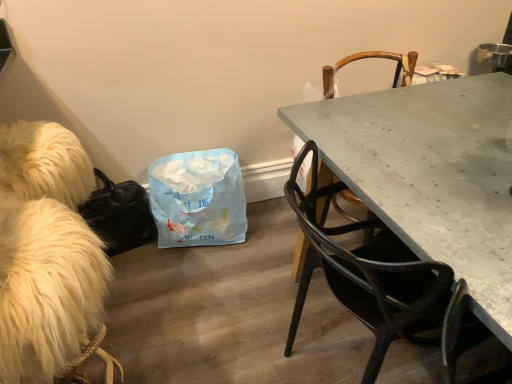
Locate an element on the screen. The image size is (512, 384). metallic gray chair at right, which appears as the 1th chair when viewed from the back is located at coordinates (373, 57).

Find the location of `light blue paper bag at center`. light blue paper bag at center is located at coordinates (198, 199).

This screenshot has width=512, height=384. Find the location of `white fluffy dog at left`. white fluffy dog at left is located at coordinates (46, 252).

Is metallic gray chair at right, the second chair when ordered from front to back, taller than light blue paper bag at center?

Indeed, metallic gray chair at right, the second chair when ordered from front to back, has a greater height compared to light blue paper bag at center.

From the image's perspective, which object appears higher, metallic gray chair at right, the second chair when ordered from front to back, or light blue paper bag at center?

metallic gray chair at right, the second chair when ordered from front to back, from the image's perspective.

In the image, is metallic gray chair at right, which appears as the 1th chair when viewed from the back, on the left side or the right side of matte black chair at right, the 1th chair viewed from the front?

metallic gray chair at right, which appears as the 1th chair when viewed from the back, is positioned on matte black chair at right, the 1th chair viewed from the front,'s right side.

Does metallic gray chair at right, the second chair when ordered from front to back, have a lesser width compared to matte black chair at right, which is counted as the 2th chair, starting from the back?

Indeed, metallic gray chair at right, the second chair when ordered from front to back, has a lesser width compared to matte black chair at right, which is counted as the 2th chair, starting from the back.

Is metallic gray chair at right, the second chair when ordered from front to back, not near matte black chair at right, which is counted as the 2th chair, starting from the back?

That's not correct — metallic gray chair at right, the second chair when ordered from front to back, is a little close to matte black chair at right, which is counted as the 2th chair, starting from the back.

Based on the photo, considering the relative sizes of metallic gray chair at right, which appears as the 1th chair when viewed from the back, and matte black chair at right, the 1th chair viewed from the front, in the image provided, is metallic gray chair at right, which appears as the 1th chair when viewed from the back, taller than matte black chair at right, the 1th chair viewed from the front,?

Correct, metallic gray chair at right, which appears as the 1th chair when viewed from the back, is much taller as matte black chair at right, the 1th chair viewed from the front.

From the image's perspective, which is above, matte black chair at right, which is counted as the 2th chair, starting from the back, or light blue paper bag at center?

light blue paper bag at center.

Can you confirm if matte black chair at right, the 1th chair viewed from the front, is thinner than light blue paper bag at center?

Incorrect, the width of matte black chair at right, the 1th chair viewed from the front, is not less than that of light blue paper bag at center.

Can light blue paper bag at center be found inside matte black chair at right, the 1th chair viewed from the front?

No, light blue paper bag at center is not inside matte black chair at right, the 1th chair viewed from the front.

Considering the points (313, 208) and (149, 180), which point is in front, point (313, 208) or point (149, 180)?

Positioned in front is point (313, 208).

Is white fluffy dog at left at the right side of metallic gray chair at right, the second chair when ordered from front to back?

In fact, white fluffy dog at left is to the left of metallic gray chair at right, the second chair when ordered from front to back.

From the image's perspective, between white fluffy dog at left and metallic gray chair at right, the second chair when ordered from front to back, who is located below?

white fluffy dog at left, from the image's perspective.

This screenshot has width=512, height=384. I want to click on the 2nd chair positioned above the white fluffy dog at left (from a real-world perspective), so click(373, 57).

Is white fluffy dog at left not close to metallic gray chair at right, which appears as the 1th chair when viewed from the back?

That's right, there is a large distance between white fluffy dog at left and metallic gray chair at right, which appears as the 1th chair when viewed from the back.

At what (x,y) coordinates should I click in order to perform the action: click on chair below the metallic gray chair at right, the second chair when ordered from front to back (from the image's perspective). Please return your answer as a coordinate pair (x, y). Looking at the image, I should click on (382, 282).

Which is closer to the camera, [461,322] or [321,179]?

The point [461,322] is in front.

Considering the positions of objects matte black chair at right, which is counted as the 2th chair, starting from the back, and metallic gray chair at right, the second chair when ordered from front to back, in the image provided, who is behind, matte black chair at right, which is counted as the 2th chair, starting from the back, or metallic gray chair at right, the second chair when ordered from front to back,?

metallic gray chair at right, the second chair when ordered from front to back.

Are light blue paper bag at center and matte black chair at right, which is counted as the 2th chair, starting from the back, located far from each other?

light blue paper bag at center is near matte black chair at right, which is counted as the 2th chair, starting from the back, not far away.

Could you measure the distance between light blue paper bag at center and matte black chair at right, the 1th chair viewed from the front?

They are 29.87 inches apart.

Looking at the image, does light blue paper bag at center seem bigger or smaller compared to matte black chair at right, the 1th chair viewed from the front?

In the image, light blue paper bag at center appears to be smaller than matte black chair at right, the 1th chair viewed from the front.

From the picture: Considering the positions of objects light blue paper bag at center and matte black chair at right, the 1th chair viewed from the front, in the image provided, who is in front, light blue paper bag at center or matte black chair at right, the 1th chair viewed from the front,?

matte black chair at right, the 1th chair viewed from the front, is more forward.

Could you tell me if white fluffy dog at left is turned towards matte black chair at right, which is counted as the 2th chair, starting from the back?

No, white fluffy dog at left is not facing towards matte black chair at right, which is counted as the 2th chair, starting from the back.

Is white fluffy dog at left completely or partially outside of matte black chair at right, which is counted as the 2th chair, starting from the back?

Indeed, white fluffy dog at left is completely outside matte black chair at right, which is counted as the 2th chair, starting from the back.

Is point (19, 209) closer or farther from the camera than point (450, 302)?

Point (19, 209) is positioned farther from the camera compared to point (450, 302).

Does white fluffy dog at left have a smaller size compared to matte black chair at right, which is counted as the 2th chair, starting from the back?

Correct, white fluffy dog at left occupies less space than matte black chair at right, which is counted as the 2th chair, starting from the back.

Find the location of a particular element. diaper bag below the metallic gray chair at right, which appears as the 1th chair when viewed from the back (from the image's perspective) is located at coordinates (198, 199).

Where is `chair located in front of the metallic gray chair at right, which appears as the 1th chair when viewed from the back`? This screenshot has width=512, height=384. chair located in front of the metallic gray chair at right, which appears as the 1th chair when viewed from the back is located at coordinates (382, 282).

Looking at the image, which one is located closer to metallic gray chair at right, which appears as the 1th chair when viewed from the back, matte black chair at right, which is counted as the 2th chair, starting from the back, or light blue paper bag at center?

The object closer to metallic gray chair at right, which appears as the 1th chair when viewed from the back, is matte black chair at right, which is counted as the 2th chair, starting from the back.

Based on their spatial positions, is light blue paper bag at center or matte black chair at right, the 1th chair viewed from the front, closer to metallic gray chair at right, the second chair when ordered from front to back?

matte black chair at right, the 1th chair viewed from the front, lies closer to metallic gray chair at right, the second chair when ordered from front to back, than the other object.

Estimate the real-world distances between objects in this image. Which object is further from light blue paper bag at center, metallic gray chair at right, which appears as the 1th chair when viewed from the back, or white fluffy dog at left?

metallic gray chair at right, which appears as the 1th chair when viewed from the back, is positioned further to the anchor light blue paper bag at center.

Looking at the image, which one is located further to white fluffy dog at left, metallic gray chair at right, the second chair when ordered from front to back, or light blue paper bag at center?

metallic gray chair at right, the second chair when ordered from front to back.

Which object lies nearer to the anchor point light blue paper bag at center, matte black chair at right, which is counted as the 2th chair, starting from the back, or white fluffy dog at left?

The object closer to light blue paper bag at center is white fluffy dog at left.

Considering their positions, is metallic gray chair at right, which appears as the 1th chair when viewed from the back, positioned closer to matte black chair at right, the 1th chair viewed from the front, than white fluffy dog at left?

white fluffy dog at left.

From the picture: Looking at the image, which one is located closer to matte black chair at right, the 1th chair viewed from the front, white fluffy dog at left or light blue paper bag at center?

white fluffy dog at left is positioned closer to the anchor matte black chair at right, the 1th chair viewed from the front.

Which object lies nearer to the anchor point white fluffy dog at left, metallic gray chair at right, the second chair when ordered from front to back, or matte black chair at right, which is counted as the 2th chair, starting from the back?

Among the two, matte black chair at right, which is counted as the 2th chair, starting from the back, is located nearer to white fluffy dog at left.

At what (x,y) coordinates should I click in order to perform the action: click on diaper bag between white fluffy dog at left and matte black chair at right, which is counted as the 2th chair, starting from the back, in the horizontal direction. Please return your answer as a coordinate pair (x, y). Looking at the image, I should click on click(198, 199).

What are the coordinates of `chair situated between white fluffy dog at left and metallic gray chair at right, the second chair when ordered from front to back, from left to right` in the screenshot? It's located at (382, 282).

Find the location of a particular element. The height and width of the screenshot is (384, 512). diaper bag situated between white fluffy dog at left and metallic gray chair at right, which appears as the 1th chair when viewed from the back, from left to right is located at coordinates (198, 199).

Find the location of a particular element. chair between matte black chair at right, which is counted as the 2th chair, starting from the back, and light blue paper bag at center, along the z-axis is located at coordinates (373, 57).